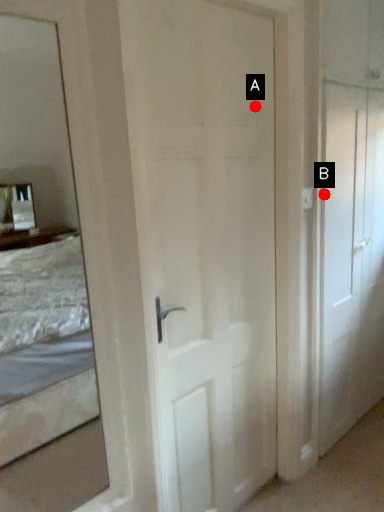
Question: Two points are circled on the image, labeled by A and B beside each circle. Among these points, which one is farthest from the camera?

Choices:
 (A) A is further
 (B) B is further

Answer: (B)